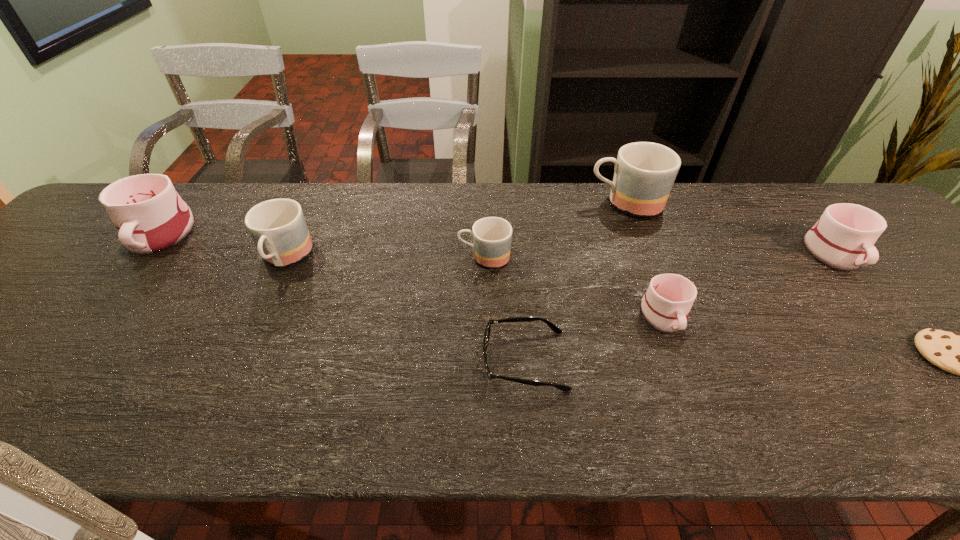
Find the location of `vacant space located 0.340m on the side with the handle of the smallest blue mug`. vacant space located 0.340m on the side with the handle of the smallest blue mug is located at coordinates (326, 257).

At what (x,y) coordinates should I click in order to perform the action: click on vacant space located 0.110m on the side with the handle of the smallest blue mug. Please return your answer as a coordinate pair (x, y). The height and width of the screenshot is (540, 960). Looking at the image, I should click on (416, 257).

The height and width of the screenshot is (540, 960). I want to click on vacant area located on the side with the handle of the second white mug from left to right, so click(x=690, y=385).

Identify the location of vacant space located 0.380m on the front-facing side of the seventh tallest object. This screenshot has width=960, height=540. (299, 360).

I want to click on vacant point located on the front-facing side of the seventh tallest object, so click(362, 360).

This screenshot has height=540, width=960. I want to click on free space located on the front-facing side of the seventh tallest object, so click(400, 360).

Where is `object at the left edge`? Image resolution: width=960 pixels, height=540 pixels. object at the left edge is located at coordinates (150, 216).

The width and height of the screenshot is (960, 540). I want to click on object that is at the right edge, so click(x=843, y=238).

Identify the location of object that is at the far left corner. Image resolution: width=960 pixels, height=540 pixels. (150, 216).

You are a GUI agent. You are given a task and a screenshot of the screen. Output one action in this format:
    pyautogui.click(x=<x>, y=<y>)
    Task: Click on the object located in the far right corner section of the desktop
    This screenshot has height=540, width=960.
    Given the screenshot: What is the action you would take?
    pyautogui.click(x=843, y=238)